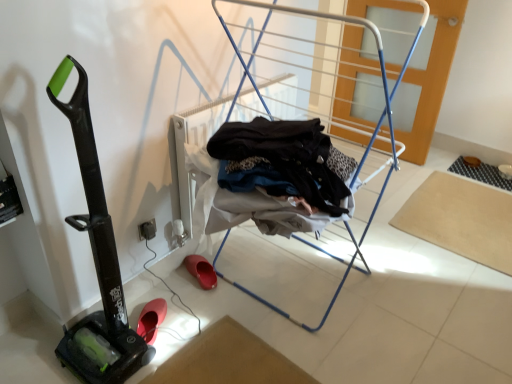
Where is `vacant area that lies between metallic blue drying rack at center and beige fabric yoga mat at lower right`? The width and height of the screenshot is (512, 384). vacant area that lies between metallic blue drying rack at center and beige fabric yoga mat at lower right is located at coordinates (407, 258).